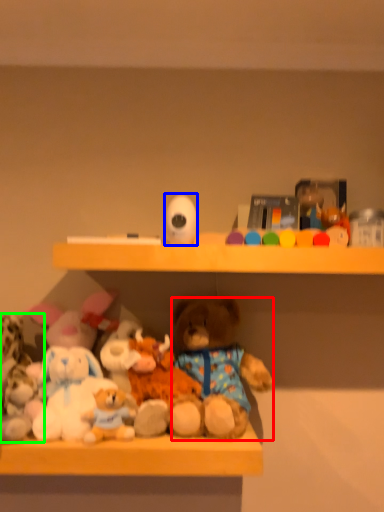
Question: Which object is the closest to the teddy bear (highlighted by a red box)? Choose among these: toy (highlighted by a blue box) or toy (highlighted by a green box).

Choices:
 (A) toy
 (B) toy

Answer: (A)